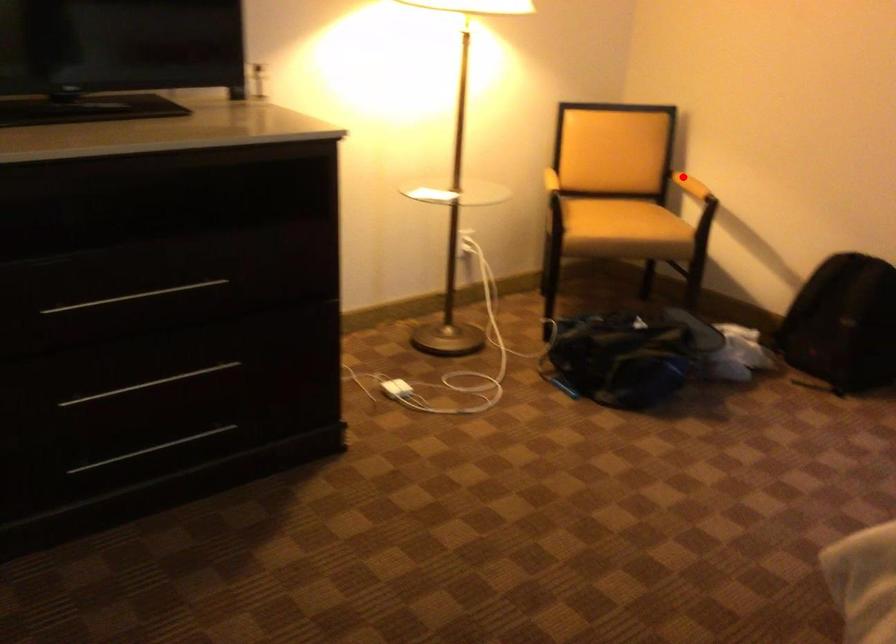
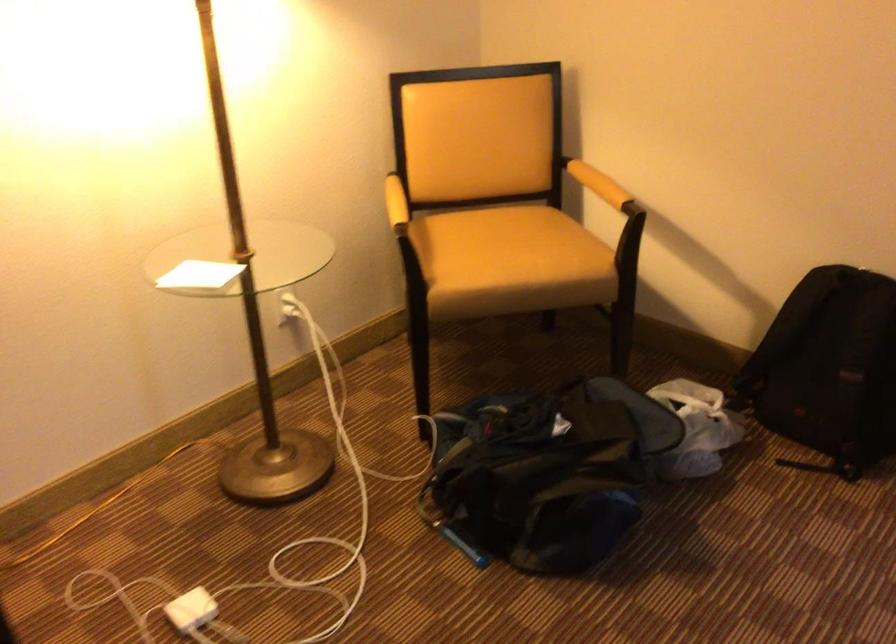
Where in the second image is the point corresponding to the highlighted location from the first image?

(598, 184)